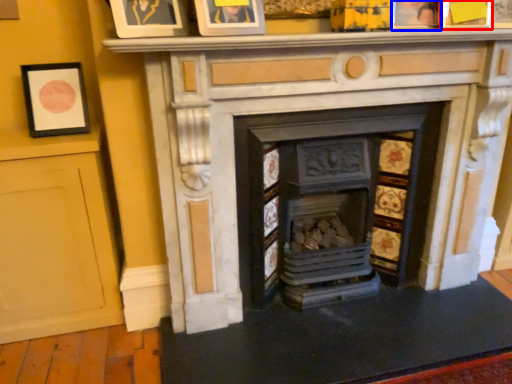
Question: Which point is further to the camera, picture frame (highlighted by a red box) or picture frame (highlighted by a blue box)?

Choices:
 (A) picture frame
 (B) picture frame

Answer: (B)